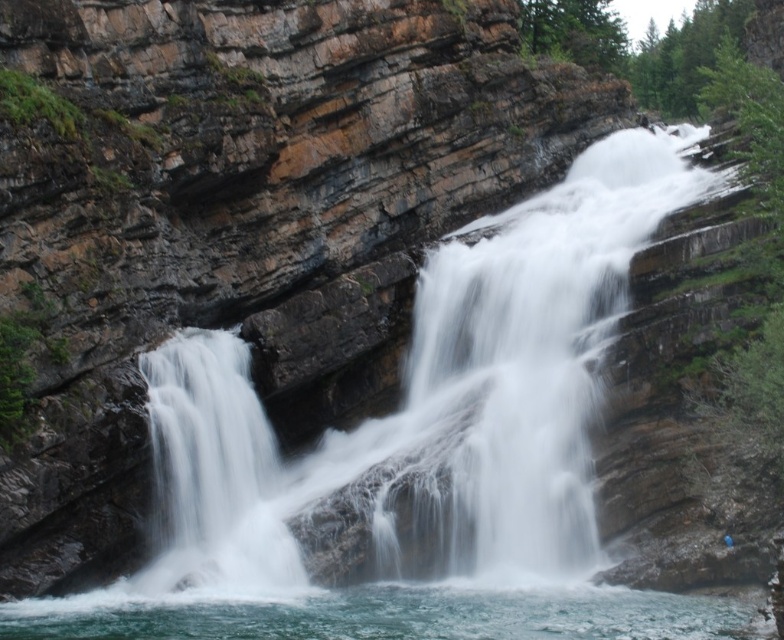
Question: Is white frothy water at center to the right of white frothy water at lower center from the viewer's perspective?

Choices:
 (A) no
 (B) yes

Answer: (B)

Question: Among these points, which one is nearest to the camera?

Choices:
 (A) (151, 600)
 (B) (575, 266)

Answer: (A)

Question: Considering the relative positions of white frothy water at center and white frothy water at lower center in the image provided, where is white frothy water at center located with respect to white frothy water at lower center?

Choices:
 (A) left
 (B) right

Answer: (B)

Question: Which object is farther from the camera taking this photo?

Choices:
 (A) white frothy water at lower center
 (B) white frothy water at center

Answer: (B)

Question: Where is white frothy water at center located in relation to white frothy water at lower center in the image?

Choices:
 (A) below
 (B) above

Answer: (B)